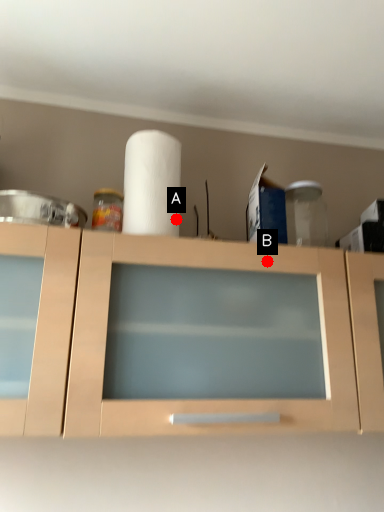
Question: Two points are circled on the image, labeled by A and B beside each circle. Which point is closer to the camera taking this photo?

Choices:
 (A) A is closer
 (B) B is closer

Answer: (B)